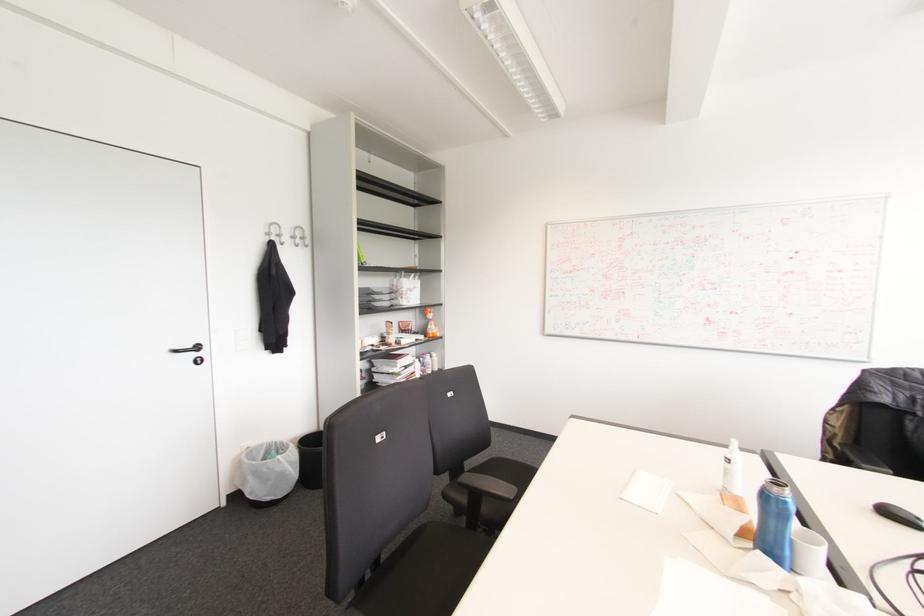
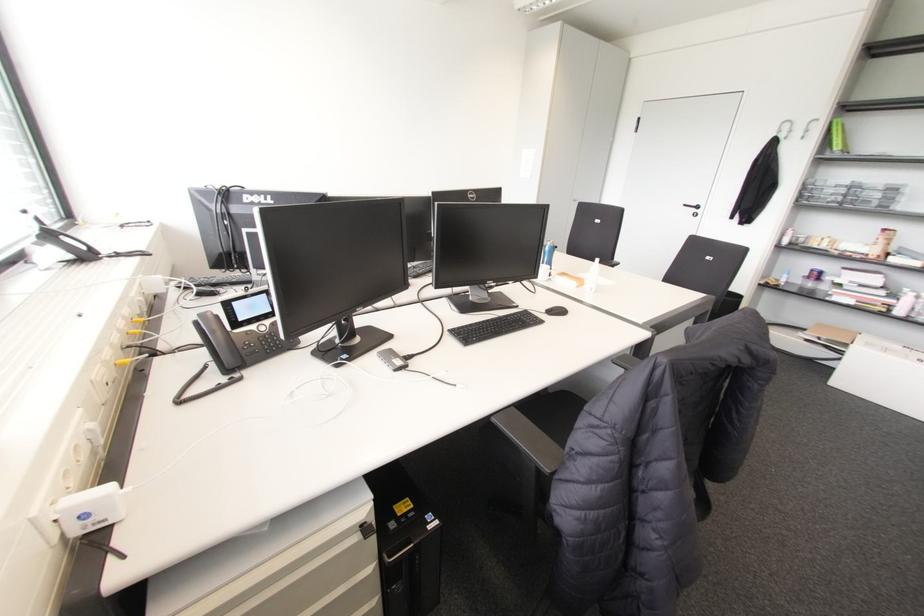
Where in the second image is the point corresponding to pixel 197 347 from the first image?

(697, 207)